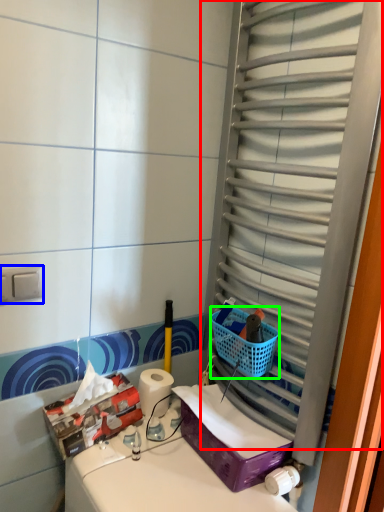
Question: Which object is the farthest from glass door (highlighted by a red box)? Choose among these: electric outlet (highlighted by a blue box) or basket (highlighted by a green box).

Choices:
 (A) electric outlet
 (B) basket

Answer: (A)